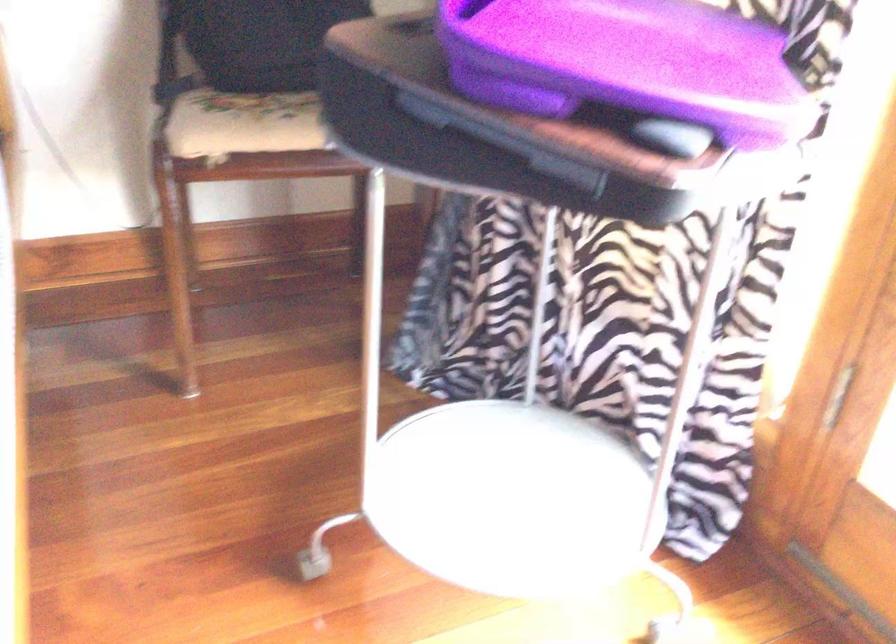
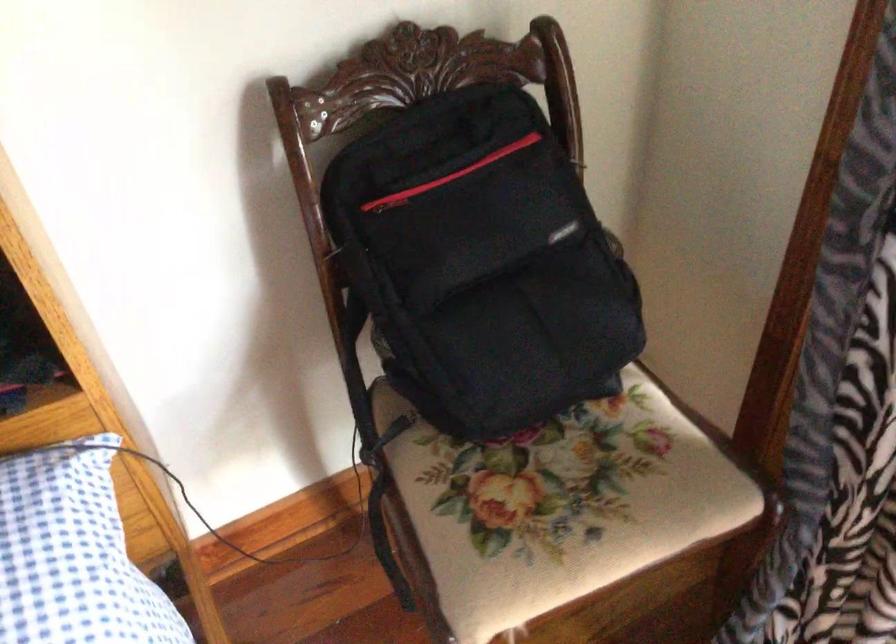
Where in the second image is the point corresponding to pixel 271 106 from the first image?

(556, 506)